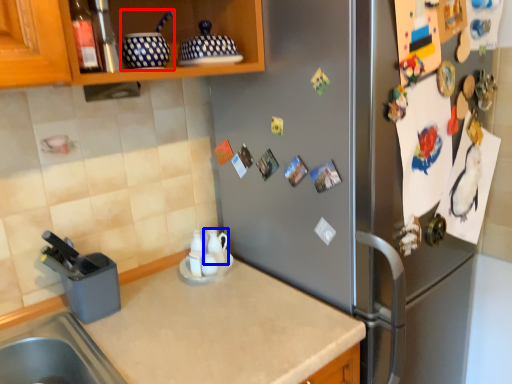
Question: Among these objects, which one is nearest to the camera, appliance (highlighted by a red box) or tea pot (highlighted by a blue box)?

Choices:
 (A) appliance
 (B) tea pot

Answer: (A)